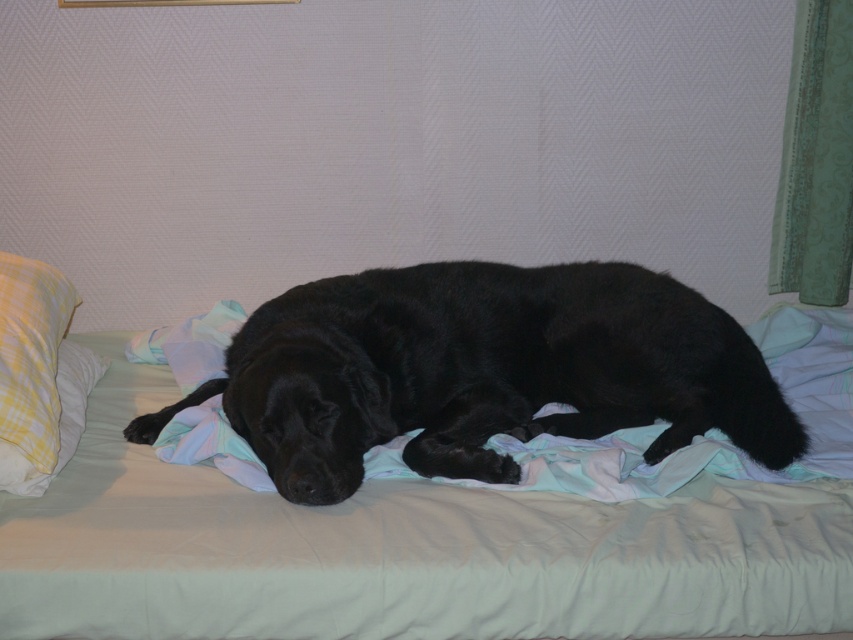
Can you confirm if silky black dog at center is positioned below yellow plaid pillow at left?

Correct, silky black dog at center is located below yellow plaid pillow at left.

Who is positioned more to the left, silky black dog at center or yellow plaid pillow at left?

yellow plaid pillow at left

Does point (683, 557) come farther from viewer compared to point (32, 432)?

That is False.

This screenshot has height=640, width=853. In order to click on silky black dog at center in this screenshot , I will do `click(402, 552)`.

Which is below, silky black dog at center or black soft fur dog at center?

silky black dog at center is below.

The image size is (853, 640). Find the location of `silky black dog at center`. silky black dog at center is located at coordinates (402, 552).

Who is higher up, black soft fur dog at center or yellow plaid pillow at left?

yellow plaid pillow at left is above.

Is black soft fur dog at center wider than yellow plaid pillow at left?

Indeed, black soft fur dog at center has a greater width compared to yellow plaid pillow at left.

Describe the element at coordinates (483, 371) in the screenshot. I see `black soft fur dog at center` at that location.

Where is `black soft fur dog at center`? The image size is (853, 640). black soft fur dog at center is located at coordinates point(483,371).